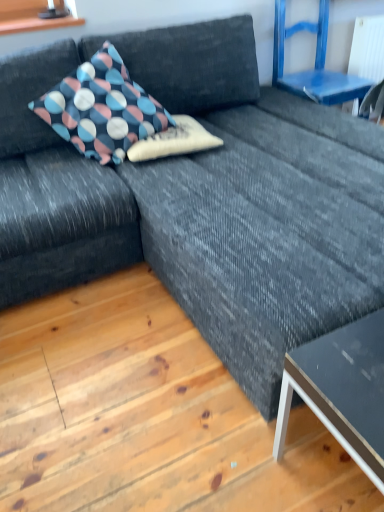
Identify the location of matte black table at lower right. The image size is (384, 512). (342, 390).

What is the approximate height of polka dot fabric pillow at upper left, the 2th pillow viewed from the right?

The height of polka dot fabric pillow at upper left, the 2th pillow viewed from the right, is 19.71 inches.

What do you see at coordinates (315, 63) in the screenshot? The width and height of the screenshot is (384, 512). I see `blue painted wood chair at upper right` at bounding box center [315, 63].

In the scene shown: What is the approximate width of polka dot fabric pillow at center, which is the first pillow in right-to-left order?

The width of polka dot fabric pillow at center, which is the first pillow in right-to-left order, is 17.01 inches.

The width and height of the screenshot is (384, 512). Identify the location of matte black table at lower right. (342, 390).

Which object is more forward, matte black table at lower right or blue painted wood chair at upper right?

matte black table at lower right is closer to the camera.

Can we say matte black table at lower right lies outside blue painted wood chair at upper right?

matte black table at lower right is positioned outside blue painted wood chair at upper right.

From the image's perspective, who appears lower, matte black table at lower right or blue painted wood chair at upper right?

matte black table at lower right.

Which is closer to the camera, (275, 450) or (321, 83)?

The point (275, 450) is more forward.

From the image's perspective, is matte black table at lower right positioned above or below polka dot fabric pillow at upper left, the 1th pillow in the left-to-right sequence?

Clearly, from the image's perspective, matte black table at lower right is below polka dot fabric pillow at upper left, the 1th pillow in the left-to-right sequence.

Considering the relative sizes of matte black table at lower right and polka dot fabric pillow at upper left, the 1th pillow in the left-to-right sequence, in the image provided, is matte black table at lower right thinner than polka dot fabric pillow at upper left, the 1th pillow in the left-to-right sequence,?

Yes.

Is matte black table at lower right in front of or behind polka dot fabric pillow at upper left, the 1th pillow in the left-to-right sequence, in the image?

matte black table at lower right is in front of polka dot fabric pillow at upper left, the 1th pillow in the left-to-right sequence.

Is point (301, 397) closer to viewer compared to point (102, 116)?

Yes, it is in front of point (102, 116).

Could you tell me if polka dot fabric pillow at upper left, the 2th pillow viewed from the right, is turned towards matte black table at lower right?

Yes, polka dot fabric pillow at upper left, the 2th pillow viewed from the right, is facing matte black table at lower right.

From a real-world perspective, which is physically above, polka dot fabric pillow at upper left, the 2th pillow viewed from the right, or matte black table at lower right?

polka dot fabric pillow at upper left, the 2th pillow viewed from the right, is physically above.

How much distance is there between polka dot fabric pillow at upper left, the 2th pillow viewed from the right, and matte black table at lower right?

polka dot fabric pillow at upper left, the 2th pillow viewed from the right, and matte black table at lower right are 1.31 meters apart.

Considering the sizes of objects polka dot fabric pillow at upper left, the 1th pillow in the left-to-right sequence, and matte black table at lower right in the image provided, who is smaller, polka dot fabric pillow at upper left, the 1th pillow in the left-to-right sequence, or matte black table at lower right?

matte black table at lower right is smaller.

Considering the positions of point (353, 413) and point (198, 125), is point (353, 413) closer or farther from the camera than point (198, 125)?

Point (353, 413) is closer to the camera than point (198, 125).

In terms of size, does matte black table at lower right appear bigger or smaller than polka dot fabric pillow at center, positioned as the 2th pillow in left-to-right order?

Clearly, matte black table at lower right is larger in size than polka dot fabric pillow at center, positioned as the 2th pillow in left-to-right order.

Between matte black table at lower right and polka dot fabric pillow at center, positioned as the 2th pillow in left-to-right order, which one is positioned in front?

matte black table at lower right.

Is matte black table at lower right not near polka dot fabric pillow at center, positioned as the 2th pillow in left-to-right order?

Yes, matte black table at lower right and polka dot fabric pillow at center, positioned as the 2th pillow in left-to-right order, are quite far apart.

Is point (329, 1) closer or farther from the camera than point (130, 156)?

Clearly, point (329, 1) is more distant from the camera than point (130, 156).

Measure the distance between blue painted wood chair at upper right and polka dot fabric pillow at center, which is the first pillow in right-to-left order.

blue painted wood chair at upper right is 1.02 meters away from polka dot fabric pillow at center, which is the first pillow in right-to-left order.

From the picture: From the image's perspective, does blue painted wood chair at upper right appear higher than polka dot fabric pillow at center, positioned as the 2th pillow in left-to-right order?

Yes, from the image's perspective, blue painted wood chair at upper right is over polka dot fabric pillow at center, positioned as the 2th pillow in left-to-right order.

Looking at this image, is polka dot fabric pillow at upper left, the 1th pillow in the left-to-right sequence, aimed at polka dot fabric pillow at center, which is the first pillow in right-to-left order?

Yes, polka dot fabric pillow at upper left, the 1th pillow in the left-to-right sequence, is turned towards polka dot fabric pillow at center, which is the first pillow in right-to-left order.

From a real-world perspective, is polka dot fabric pillow at upper left, the 2th pillow viewed from the right, on top of polka dot fabric pillow at center, which is the first pillow in right-to-left order?

Indeed, from a real-world perspective, polka dot fabric pillow at upper left, the 2th pillow viewed from the right, stands above polka dot fabric pillow at center, which is the first pillow in right-to-left order.

Could you measure the distance between polka dot fabric pillow at upper left, the 2th pillow viewed from the right, and polka dot fabric pillow at center, positioned as the 2th pillow in left-to-right order?

polka dot fabric pillow at upper left, the 2th pillow viewed from the right, and polka dot fabric pillow at center, positioned as the 2th pillow in left-to-right order, are 19.30 centimeters apart from each other.

In terms of height, does polka dot fabric pillow at upper left, the 2th pillow viewed from the right, look taller or shorter compared to polka dot fabric pillow at center, which is the first pillow in right-to-left order?

Clearly, polka dot fabric pillow at upper left, the 2th pillow viewed from the right, is taller compared to polka dot fabric pillow at center, which is the first pillow in right-to-left order.

Considering the relative positions of polka dot fabric pillow at center, positioned as the 2th pillow in left-to-right order, and polka dot fabric pillow at upper left, the 1th pillow in the left-to-right sequence, in the image provided, is polka dot fabric pillow at center, positioned as the 2th pillow in left-to-right order, to the right of polka dot fabric pillow at upper left, the 1th pillow in the left-to-right sequence, from the viewer's perspective?

Correct, you'll find polka dot fabric pillow at center, positioned as the 2th pillow in left-to-right order, to the right of polka dot fabric pillow at upper left, the 1th pillow in the left-to-right sequence.

Which object is wider, polka dot fabric pillow at center, which is the first pillow in right-to-left order, or polka dot fabric pillow at upper left, the 2th pillow viewed from the right?

With larger width is polka dot fabric pillow at upper left, the 2th pillow viewed from the right.

Is polka dot fabric pillow at center, positioned as the 2th pillow in left-to-right order, positioned with its back to polka dot fabric pillow at upper left, the 1th pillow in the left-to-right sequence?

Absolutely, polka dot fabric pillow at center, positioned as the 2th pillow in left-to-right order, is directed away from polka dot fabric pillow at upper left, the 1th pillow in the left-to-right sequence.

Where is `table below the blue painted wood chair at upper right (from the image's perspective)`? This screenshot has width=384, height=512. table below the blue painted wood chair at upper right (from the image's perspective) is located at coordinates coord(342,390).

Where is `the 2nd pillow above the matte black table at lower right (from the image's perspective)`? Image resolution: width=384 pixels, height=512 pixels. the 2nd pillow above the matte black table at lower right (from the image's perspective) is located at coordinates (102, 108).

When comparing their distances from polka dot fabric pillow at upper left, the 1th pillow in the left-to-right sequence, does polka dot fabric pillow at center, positioned as the 2th pillow in left-to-right order, or matte black table at lower right seem closer?

polka dot fabric pillow at center, positioned as the 2th pillow in left-to-right order, is positioned closer to the anchor polka dot fabric pillow at upper left, the 1th pillow in the left-to-right sequence.

From the image, which object appears to be nearer to blue painted wood chair at upper right, polka dot fabric pillow at center, positioned as the 2th pillow in left-to-right order, or polka dot fabric pillow at upper left, the 2th pillow viewed from the right?

polka dot fabric pillow at center, positioned as the 2th pillow in left-to-right order, is closer to blue painted wood chair at upper right.

Which object lies nearer to the anchor point polka dot fabric pillow at upper left, the 1th pillow in the left-to-right sequence, blue painted wood chair at upper right or polka dot fabric pillow at center, positioned as the 2th pillow in left-to-right order?

polka dot fabric pillow at center, positioned as the 2th pillow in left-to-right order, is closer to polka dot fabric pillow at upper left, the 1th pillow in the left-to-right sequence.

Estimate the real-world distances between objects in this image. Which object is further from blue painted wood chair at upper right, polka dot fabric pillow at center, which is the first pillow in right-to-left order, or matte black table at lower right?

matte black table at lower right.

Estimate the real-world distances between objects in this image. Which object is further from matte black table at lower right, polka dot fabric pillow at upper left, the 2th pillow viewed from the right, or blue painted wood chair at upper right?

blue painted wood chair at upper right lies further to matte black table at lower right than the other object.

Based on the photo, looking at the image, which one is located further to matte black table at lower right, blue painted wood chair at upper right or polka dot fabric pillow at center, positioned as the 2th pillow in left-to-right order?

blue painted wood chair at upper right is positioned further to the anchor matte black table at lower right.

Which object lies nearer to the anchor point polka dot fabric pillow at upper left, the 1th pillow in the left-to-right sequence, matte black table at lower right or polka dot fabric pillow at center, positioned as the 2th pillow in left-to-right order?

polka dot fabric pillow at center, positioned as the 2th pillow in left-to-right order, is closer to polka dot fabric pillow at upper left, the 1th pillow in the left-to-right sequence.

Considering their positions, is polka dot fabric pillow at center, positioned as the 2th pillow in left-to-right order, positioned closer to matte black table at lower right than polka dot fabric pillow at upper left, the 2th pillow viewed from the right?

Based on the image, polka dot fabric pillow at center, positioned as the 2th pillow in left-to-right order, appears to be nearer to matte black table at lower right.

The width and height of the screenshot is (384, 512). I want to click on pillow between polka dot fabric pillow at upper left, the 2th pillow viewed from the right, and blue painted wood chair at upper right, in the horizontal direction, so click(x=174, y=141).

Where is `pillow between polka dot fabric pillow at upper left, the 2th pillow viewed from the right, and matte black table at lower right, in the vertical direction`? pillow between polka dot fabric pillow at upper left, the 2th pillow viewed from the right, and matte black table at lower right, in the vertical direction is located at coordinates (174, 141).